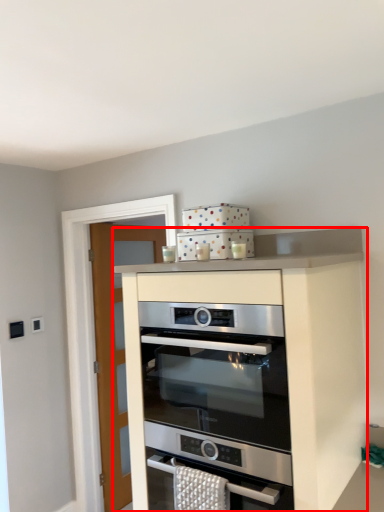
Question: From the image, what is the correct spatial relationship of cabinetry (annotated by the red box) in relation to oven?

Choices:
 (A) left
 (B) right

Answer: (B)